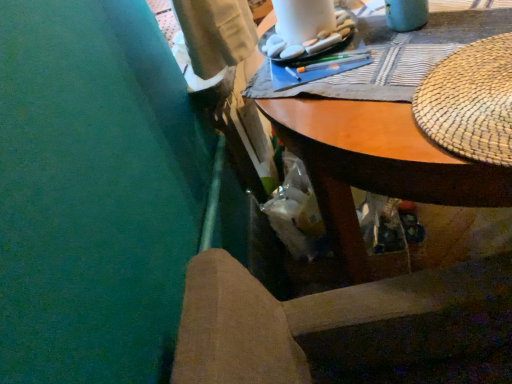
Locate an element on the screen. The height and width of the screenshot is (384, 512). vacant space that is in between white matte rocks at upper center and woven straw placemat at upper right is located at coordinates (373, 67).